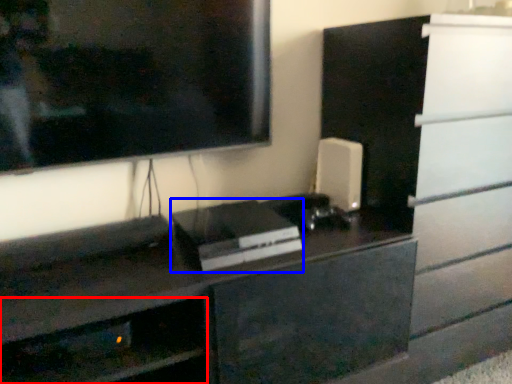
Question: Which object appears closest to the camera in this image, shelf (highlighted by a red box) or appliance (highlighted by a blue box)?

Choices:
 (A) shelf
 (B) appliance

Answer: (A)